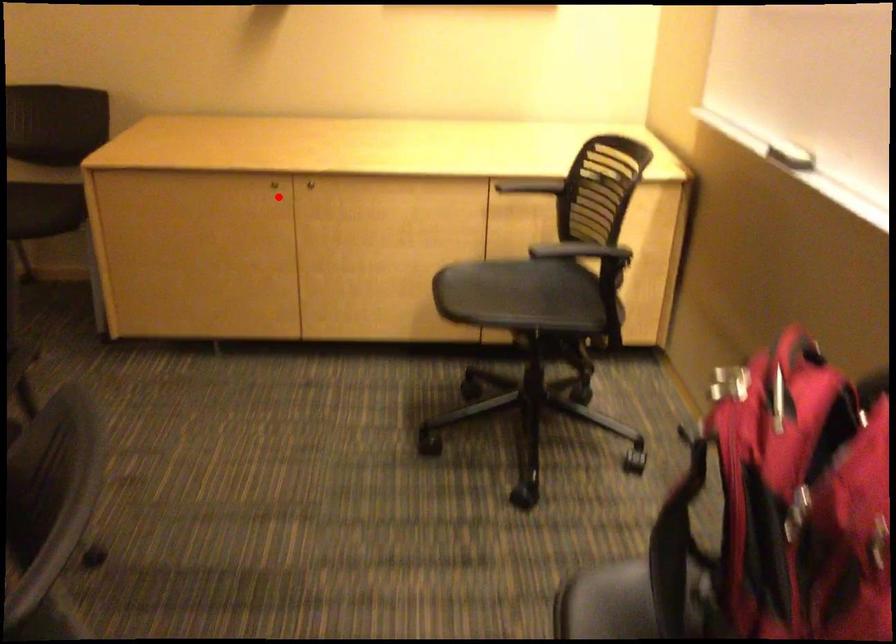
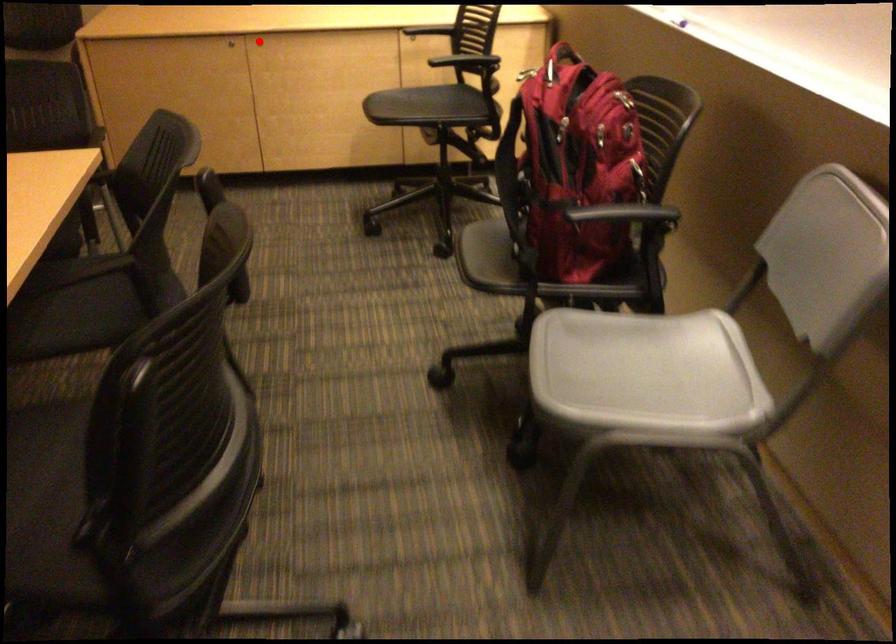
I am providing you with two images of the same scene from different viewpoints. A red point is marked on the first image and another point is marked on the second image. Does the point marked in image1 correspond to the same location as the one in image2?

No